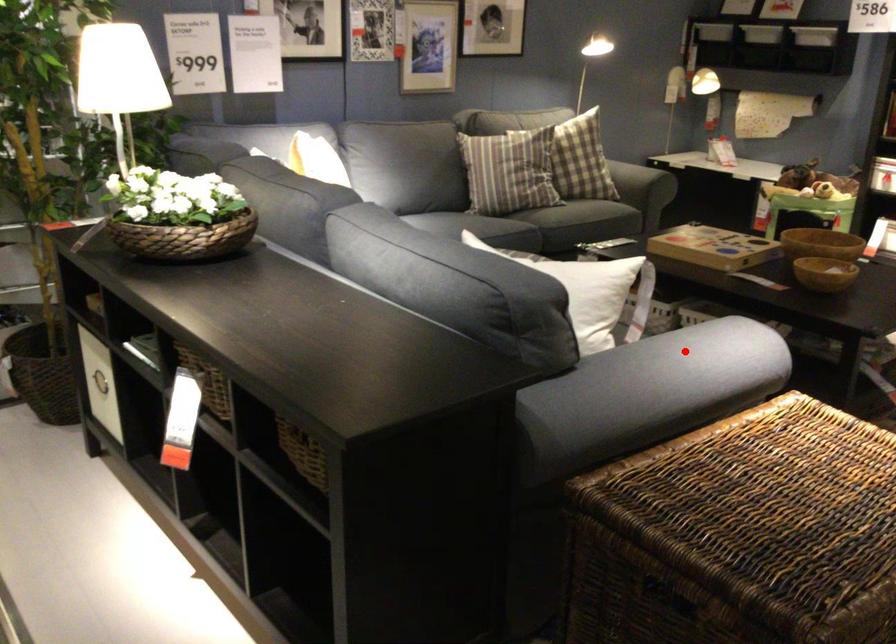
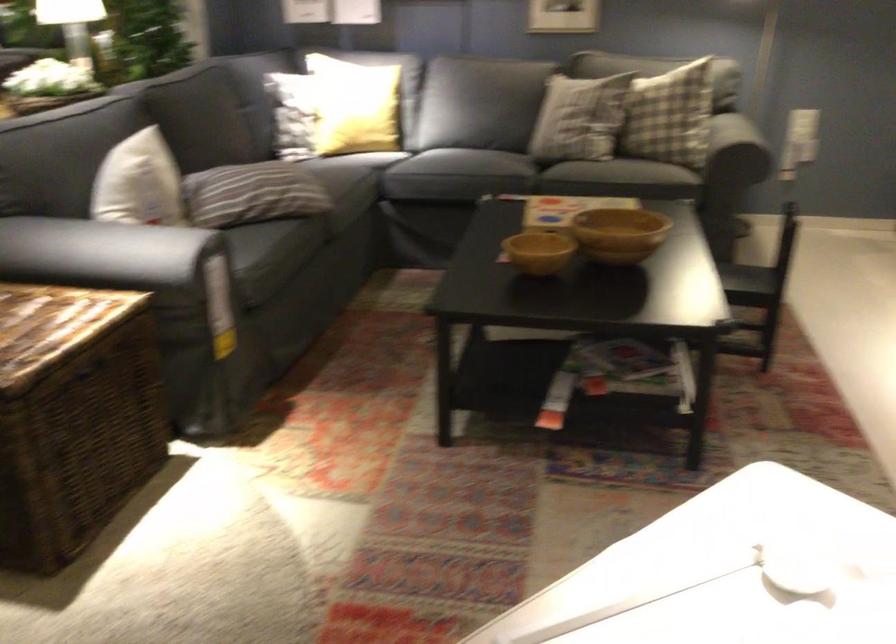
Question: I am providing you with two images of the same scene from different viewpoints. In image1, a red point is highlighted. Considering the same 3D point in image2, which of the following is correct?

Choices:
 (A) It is closer
 (B) It is farther

Answer: (B)